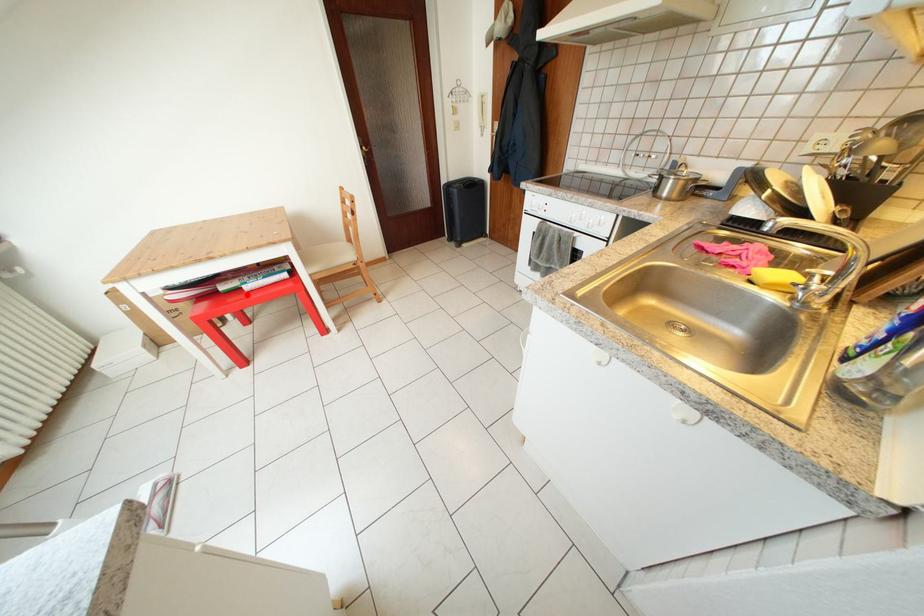
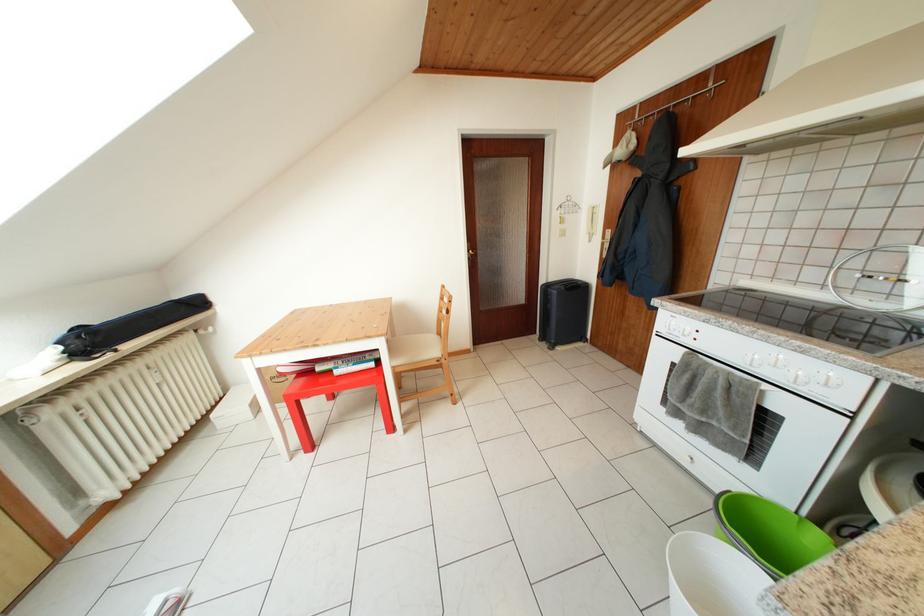
Where in the second image is the point corresponding to the highlighted location from the first image?

(338, 377)